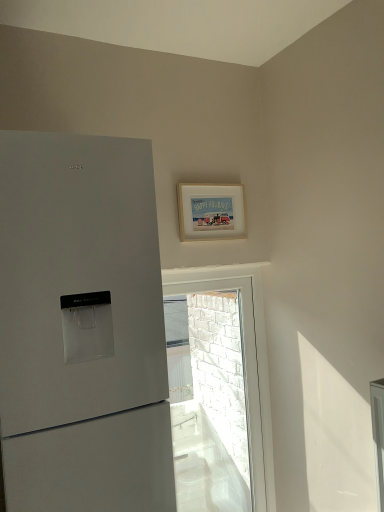
Question: In terms of height, does white matte picture frame at upper center look taller or shorter compared to white brick wall at upper center?

Choices:
 (A) tall
 (B) short

Answer: (B)

Question: Considering the positions of white matte picture frame at upper center and white brick wall at upper center in the image, is white matte picture frame at upper center wider or thinner than white brick wall at upper center?

Choices:
 (A) wide
 (B) thin

Answer: (B)

Question: From the image's perspective, is white matte picture frame at upper center above or below white brick wall at upper center?

Choices:
 (A) below
 (B) above

Answer: (B)

Question: Looking at the image, does white brick wall at upper center seem bigger or smaller compared to white matte picture frame at upper center?

Choices:
 (A) big
 (B) small

Answer: (A)

Question: From the image's perspective, relative to white matte picture frame at upper center, is white brick wall at upper center above or below?

Choices:
 (A) below
 (B) above

Answer: (A)

Question: Is white brick wall at upper center spatially inside white matte picture frame at upper center, or outside of it?

Choices:
 (A) outside
 (B) inside

Answer: (A)

Question: Is white brick wall at upper center in front of or behind white matte picture frame at upper center in the image?

Choices:
 (A) front
 (B) behind

Answer: (B)